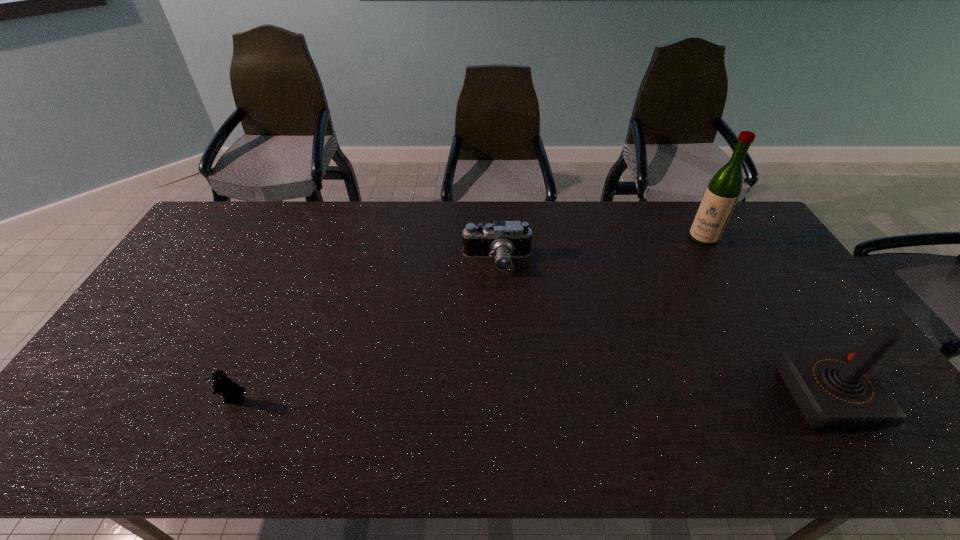
In the image, there is a desktop. Identify the location of free space at the far edge. This screenshot has height=540, width=960. (372, 204).

In the image, there is a desktop. At what (x,y) coordinates should I click in order to perform the action: click on blank space at the near edge. Please return your answer as a coordinate pair (x, y). The height and width of the screenshot is (540, 960). Looking at the image, I should click on (521, 410).

Locate an element on the screen. vacant area at the left edge is located at coordinates (129, 369).

In the image, there is a desktop. Find the location of `vacant space at the right edge`. vacant space at the right edge is located at coordinates (730, 247).

Locate an element on the screen. Image resolution: width=960 pixels, height=540 pixels. free point between the tallest object and the leftmost object is located at coordinates (468, 319).

In order to click on free spot between the Lego and the camera in this screenshot , I will do `click(366, 330)`.

Where is `free space between the joystick and the second object from left to right`? The height and width of the screenshot is (540, 960). free space between the joystick and the second object from left to right is located at coordinates (662, 330).

At what (x,y) coordinates should I click in order to perform the action: click on free space between the second tallest object and the tallest object. Please return your answer as a coordinate pair (x, y). The height and width of the screenshot is (540, 960). Looking at the image, I should click on (765, 318).

Locate an element on the screen. free space between the joystick and the Lego is located at coordinates (531, 399).

I want to click on free space between the farthest object and the third shortest object, so click(765, 318).